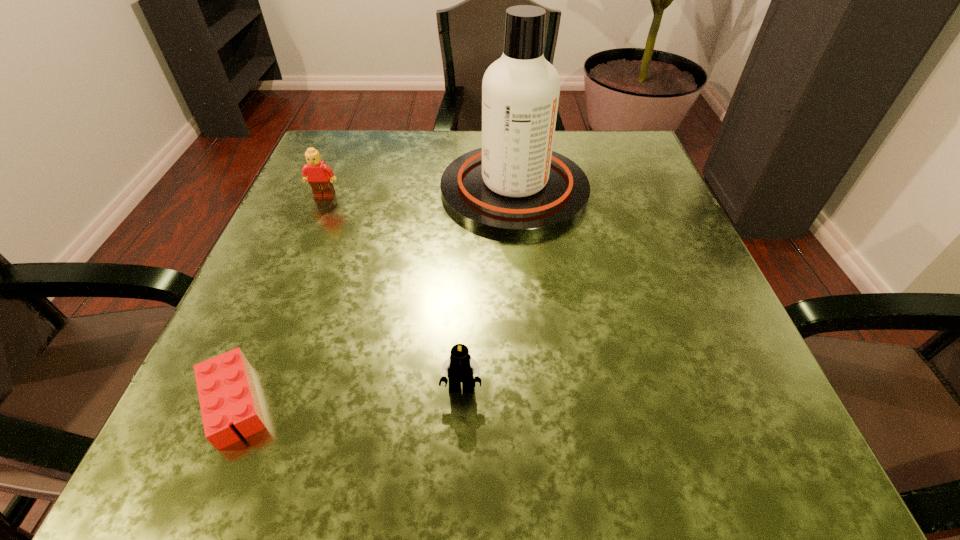
Find the location of `free space between the cleansing agent and the tallest Lego`. free space between the cleansing agent and the tallest Lego is located at coordinates (420, 193).

You are a GUI agent. You are given a task and a screenshot of the screen. Output one action in this format:
    pyautogui.click(x=<x>, y=<y>)
    Task: Click on the free space between the second tallest object and the cleansing agent
    This screenshot has width=960, height=540.
    Given the screenshot: What is the action you would take?
    pyautogui.click(x=420, y=193)

Identify which object is the third closest to the farthest Lego. Please provide its 2D coordinates. Your answer should be formatted as a tuple, i.e. [(x, y)], where the tuple contains the x and y coordinates of a point satisfying the conditions above.

[(460, 367)]

Identify which object is the nearest to the second shortest Lego. Please provide its 2D coordinates. Your answer should be formatted as a tuple, i.e. [(x, y)], where the tuple contains the x and y coordinates of a point satisfying the conditions above.

[(227, 394)]

Locate an element on the screen. The image size is (960, 540). the closest Lego to the tallest Lego is located at coordinates (227, 394).

Select which Lego appears as the closest to the tallest Lego. Please provide its 2D coordinates. Your answer should be formatted as a tuple, i.e. [(x, y)], where the tuple contains the x and y coordinates of a point satisfying the conditions above.

[(227, 394)]